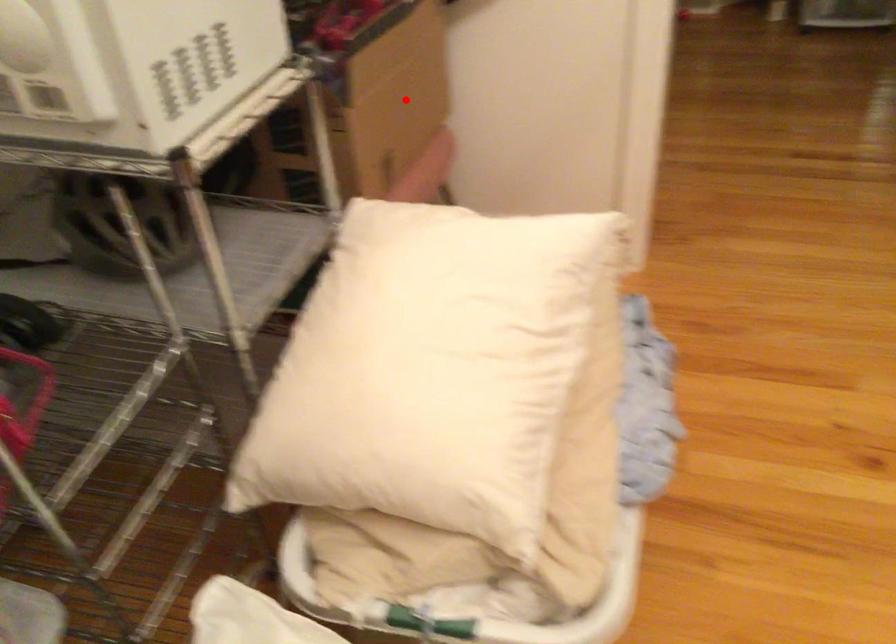
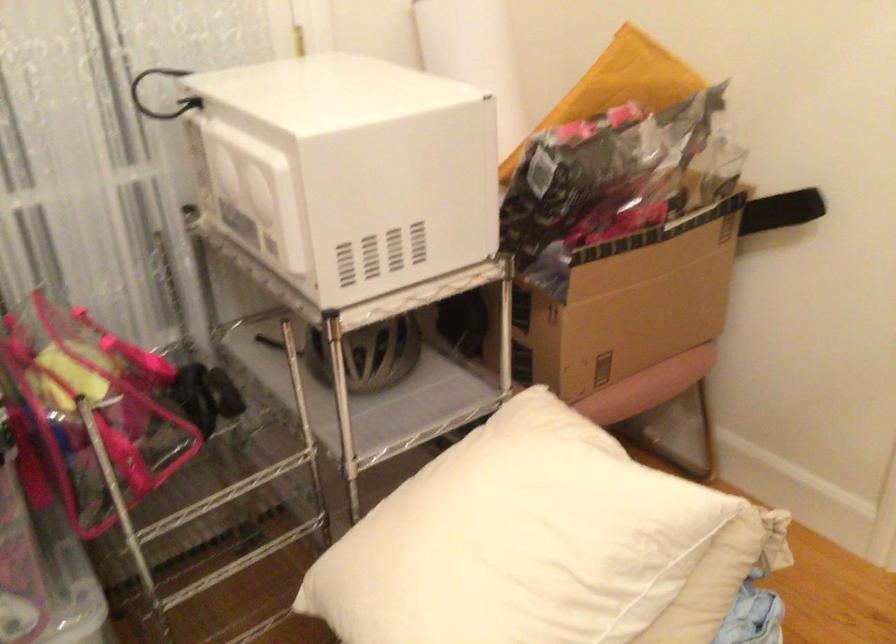
In the second image, find the point that corresponds to the highlighted location in the first image.

(636, 312)